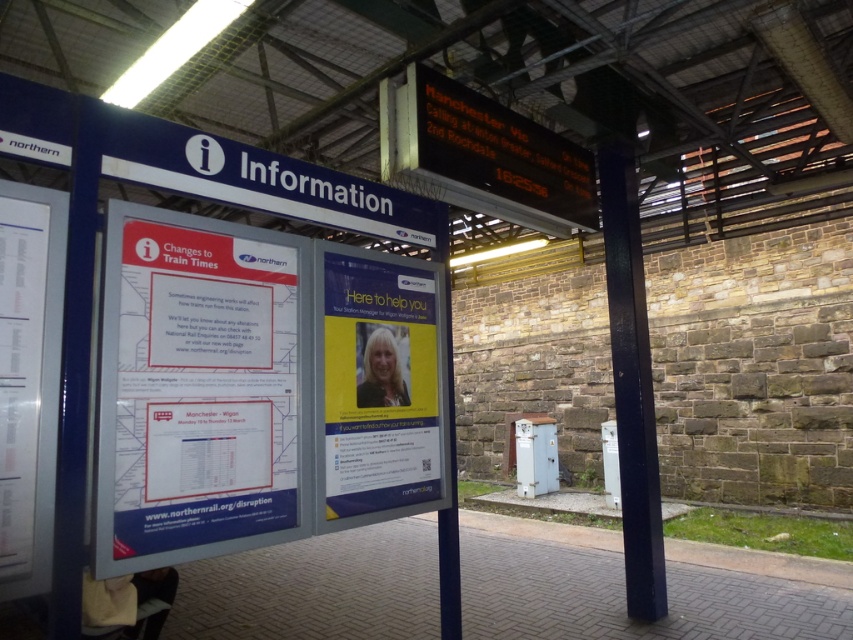
Question: Does yellow paper poster at center have a lesser width compared to white paper at left?

Choices:
 (A) yes
 (B) no

Answer: (B)

Question: Does yellow paper poster at center appear on the left side of white paper at left?

Choices:
 (A) no
 (B) yes

Answer: (A)

Question: Which object is positioned farthest from the white paper at left?

Choices:
 (A) smooth dark blue pole at right
 (B) yellow paper poster at center

Answer: (A)

Question: Which object appears closest to the camera in this image?

Choices:
 (A) white paper at left
 (B) smooth dark blue pole at right

Answer: (A)

Question: Is yellow paper poster at center further to camera compared to white paper at left?

Choices:
 (A) yes
 (B) no

Answer: (A)

Question: Which point is closer to the camera taking this photo?

Choices:
 (A) [x=613, y=200]
 (B) [x=41, y=216]

Answer: (B)